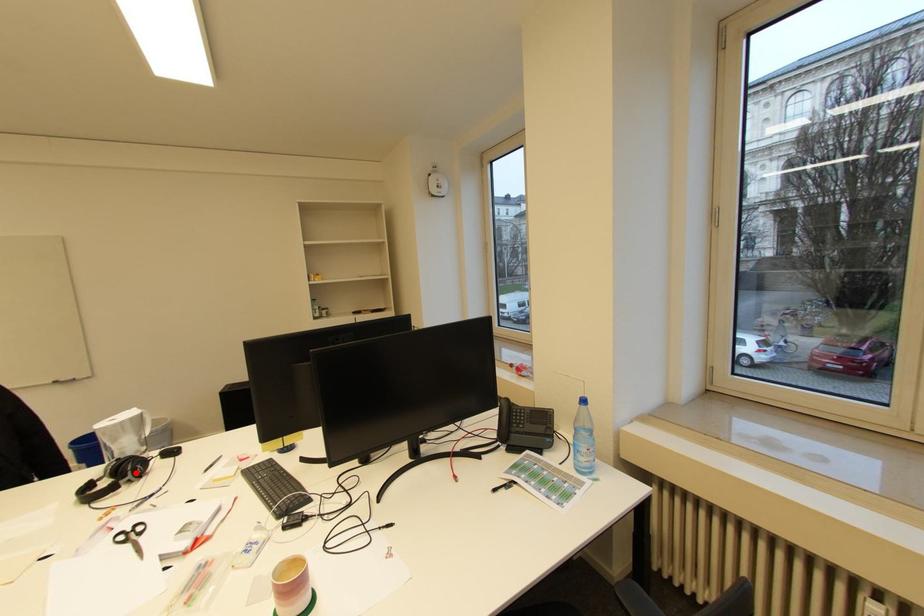
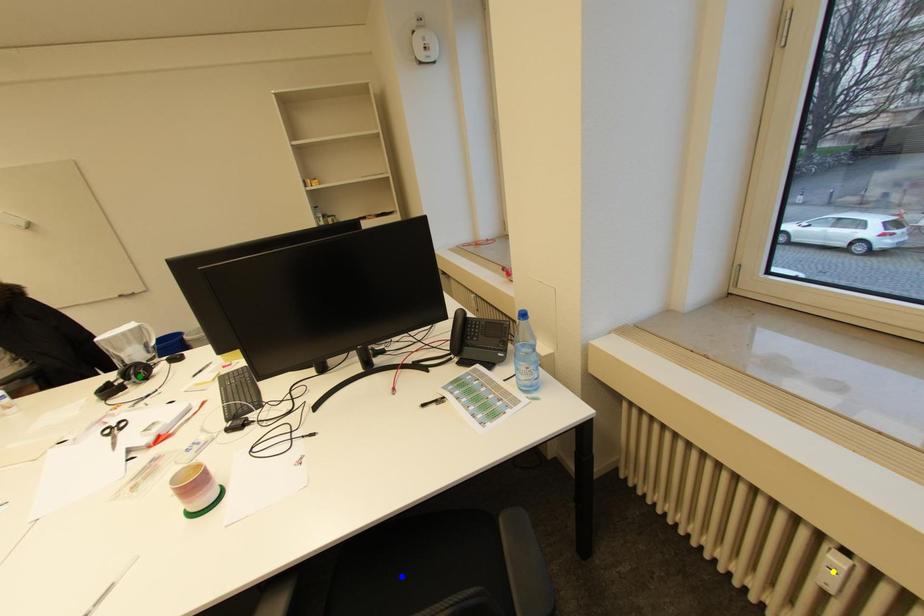
Question: I am providing you with two images of the same scene from different viewpoints. A red point is marked on the first image. You are given multiple points on the second image. Which mark in image 2 goes with the point in image 1?

Choices:
 (A) green point
 (B) blue point
 (C) yellow point

Answer: (A)